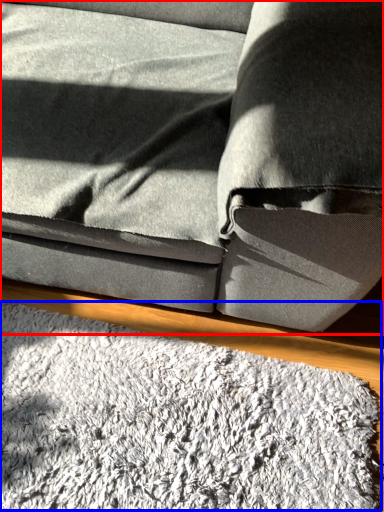
Question: Which object appears closest to the camera in this image, studio couch (highlighted by a red box) or mat (highlighted by a blue box)?

Choices:
 (A) studio couch
 (B) mat

Answer: (A)